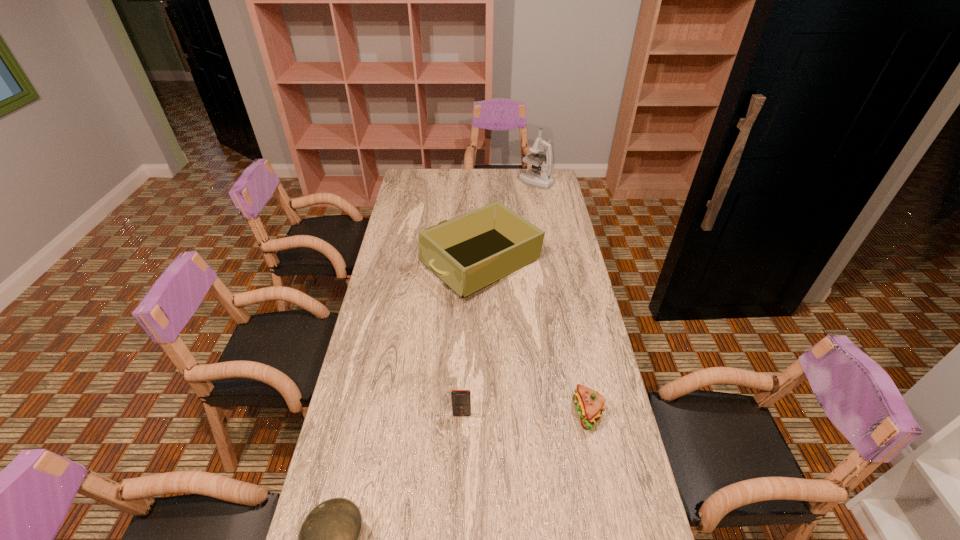
Identify the location of the farthest object. This screenshot has width=960, height=540. (543, 179).

The width and height of the screenshot is (960, 540). I want to click on the tallest object, so click(543, 179).

Locate an element on the screen. Image resolution: width=960 pixels, height=540 pixels. the fourth nearest object is located at coordinates (469, 252).

Identify the location of box. (469, 252).

The height and width of the screenshot is (540, 960). What are the coordinates of `cellular telephone` in the screenshot? It's located at (461, 399).

This screenshot has width=960, height=540. What are the coordinates of `sandwich` in the screenshot? It's located at (589, 403).

Identify the location of free region located on the left of the microscope. The height and width of the screenshot is (540, 960). (500, 181).

Locate an element on the screen. free space located 0.130m on the left of the fourth nearest object is located at coordinates (389, 264).

Identify the location of free space located on the screen of the cellular telephone. coord(461,442).

The width and height of the screenshot is (960, 540). What are the coordinates of `vacant space located on the left of the sandwich` in the screenshot? It's located at (523, 413).